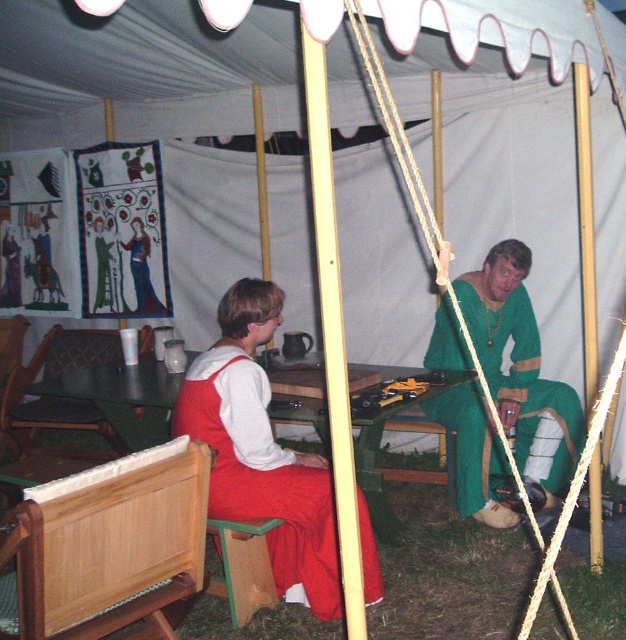
Between green fabric dress at center and wooden table at center, which one appears on the left side from the viewer's perspective?

From the viewer's perspective, wooden table at center appears more on the left side.

Can you confirm if green fabric dress at center is taller than wooden table at center?

Correct, green fabric dress at center is much taller as wooden table at center.

Does point (570, 452) come closer to viewer compared to point (121, 394)?

No, it is not.

Identify the location of green fabric dress at center. pyautogui.click(x=520, y=369).

Is wooden chair at center in front of wooden textured chair at center?

Yes.

Between wooden chair at center and wooden textured chair at center, which one has less height?

wooden chair at center

Is point (83, 477) positioned after point (111, 444)?

That is False.

You are a GUI agent. You are given a task and a screenshot of the screen. Output one action in this format:
    pyautogui.click(x=<x>, y=<y>)
    Task: Click on the wooden chair at center
    The image size is (626, 640).
    Given the screenshot: What is the action you would take?
    pyautogui.click(x=108, y=547)

Who is positioned more to the left, green fabric dress at center or wooden textured chair at center?

Positioned to the left is wooden textured chair at center.

Is green fabric dress at center to the right of wooden textured chair at center from the viewer's perspective?

Correct, you'll find green fabric dress at center to the right of wooden textured chair at center.

Who is more forward, (490, 268) or (58, 401)?

Point (490, 268) is in front.

Where is `green fabric dress at center`? This screenshot has width=626, height=640. green fabric dress at center is located at coordinates (520, 369).